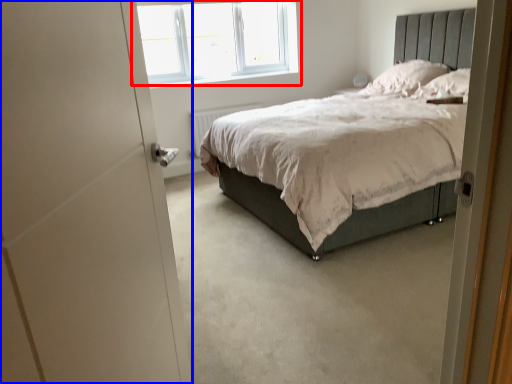
Question: Which point is closer to the camera, window (highlighted by a red box) or screen door (highlighted by a blue box)?

Choices:
 (A) window
 (B) screen door

Answer: (B)